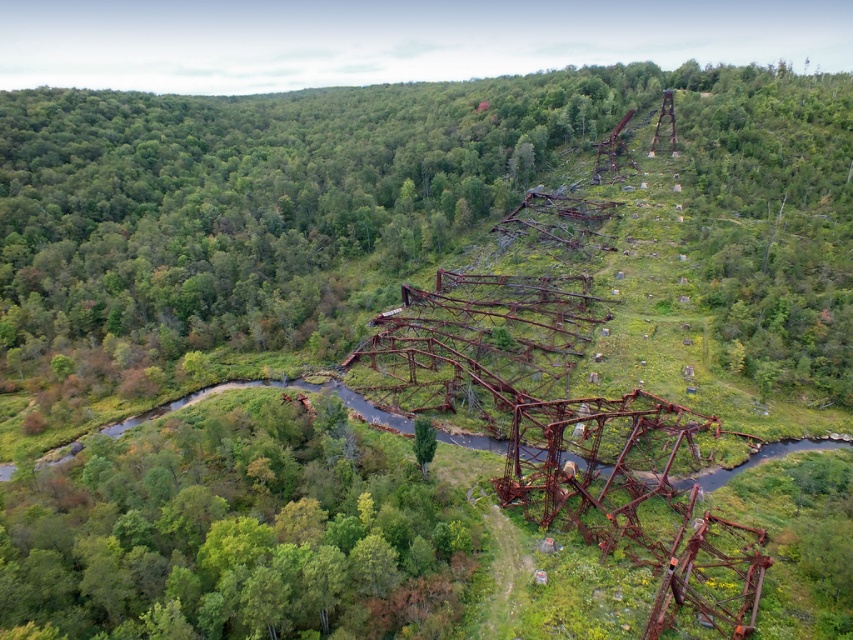
Question: Does green matte tree at lower left appear on the left side of green matte tree at center?

Choices:
 (A) no
 (B) yes

Answer: (B)

Question: Can you confirm if green matte tree at lower left is positioned above green matte tree at center?

Choices:
 (A) no
 (B) yes

Answer: (A)

Question: Is green matte tree at lower left bigger than green matte tree at center?

Choices:
 (A) yes
 (B) no

Answer: (A)

Question: Which point is closer to the camera?

Choices:
 (A) (376, 596)
 (B) (415, 451)

Answer: (A)

Question: Among these objects, which one is nearest to the camera?

Choices:
 (A) green matte tree at center
 (B) green matte tree at lower left

Answer: (B)